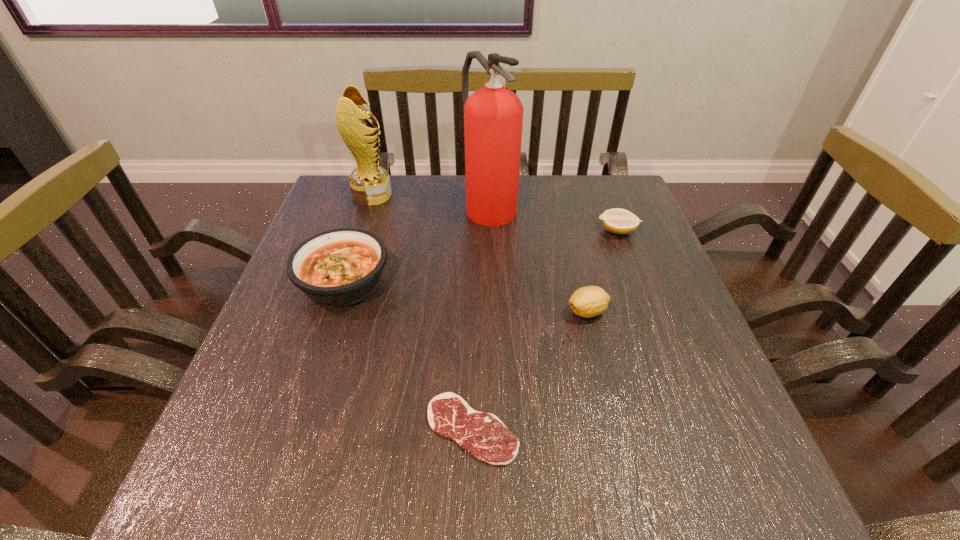
The width and height of the screenshot is (960, 540). I want to click on the tallest object, so click(x=493, y=116).

The width and height of the screenshot is (960, 540). I want to click on award, so click(370, 185).

This screenshot has height=540, width=960. I want to click on stew, so [x=339, y=267].

Find the location of a particular element. the fourth tallest object is located at coordinates (589, 301).

What are the coordinates of `the second object from right to left` in the screenshot? It's located at (589, 301).

Where is `the farther lemon`? the farther lemon is located at coordinates (618, 221).

At what (x,y) coordinates should I click in order to perform the action: click on the shorter lemon. Please return your answer as a coordinate pair (x, y). Looking at the image, I should click on (618, 221).

Where is `the shortest object`? The width and height of the screenshot is (960, 540). the shortest object is located at coordinates (483, 435).

Identify the location of the nearest object. (483, 435).

I want to click on vacant space located 0.100m on the handle side of the tallest object, so click(x=491, y=255).